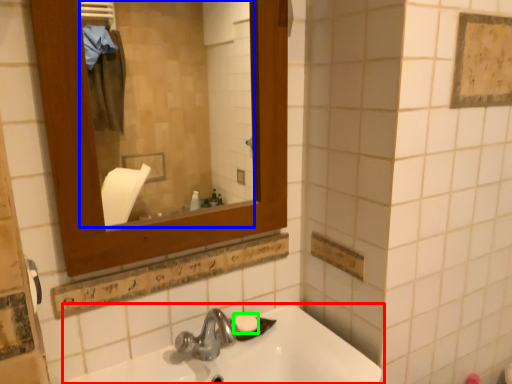
Question: Based on their relative distances, which object is nearer to sink (highlighted by a red box)? Choose from mirror (highlighted by a blue box) and soap (highlighted by a green box).

Choices:
 (A) mirror
 (B) soap

Answer: (B)